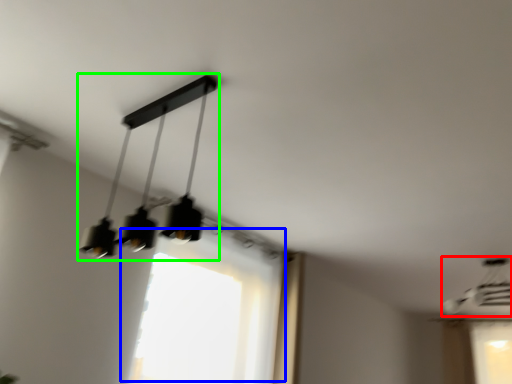
Question: Considering the real-world distances, which object is farthest from lamp (highlighted by a red box)? window (highlighted by a blue box) or lamp (highlighted by a green box)?

Choices:
 (A) window
 (B) lamp

Answer: (B)